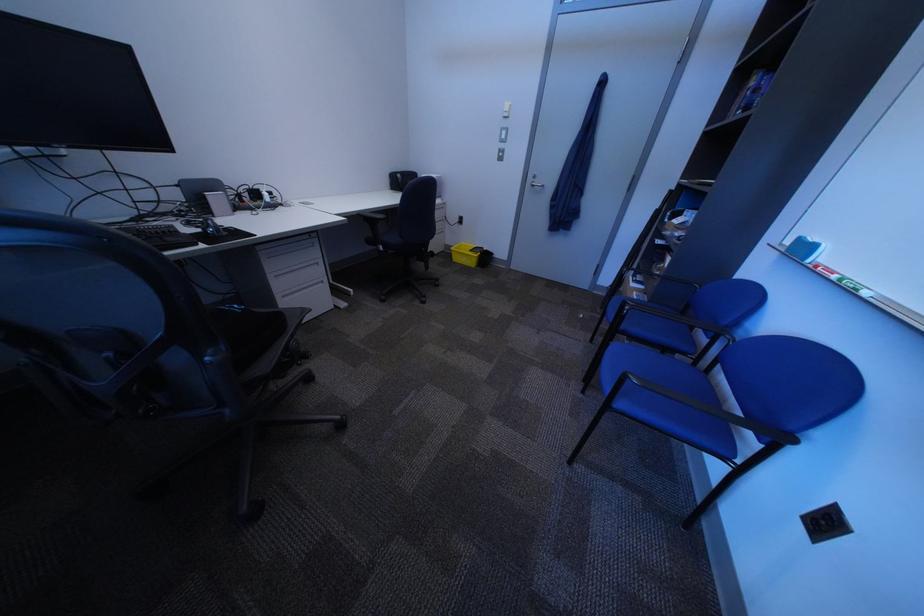
I want to click on grey drawer handle, so click(440, 228).